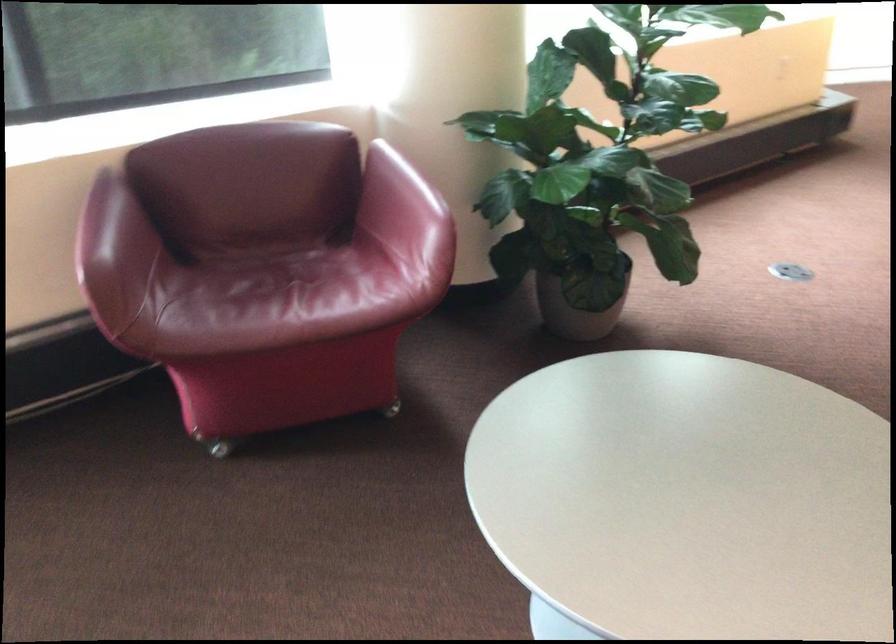
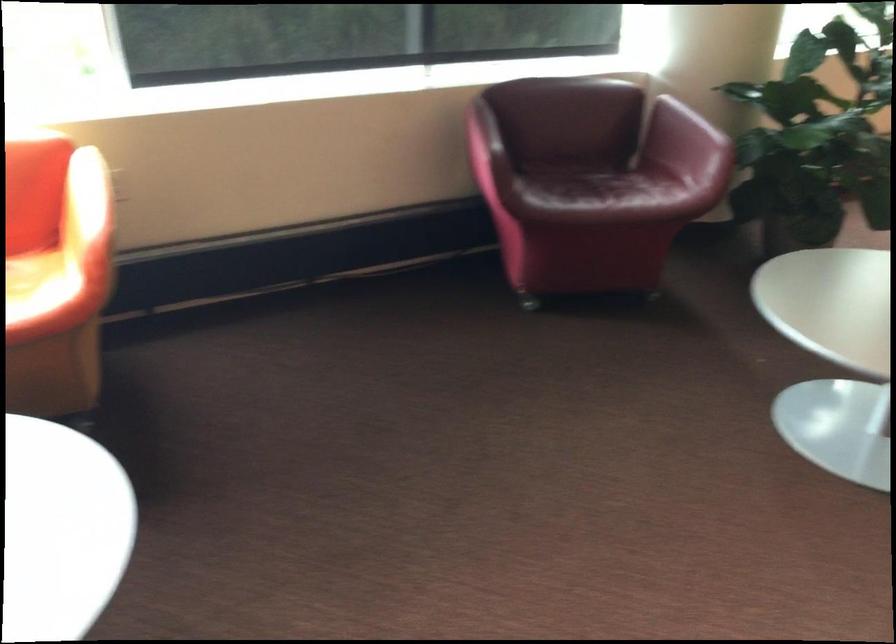
Where in the second image is the point corresponding to point (109, 259) from the first image?

(483, 140)